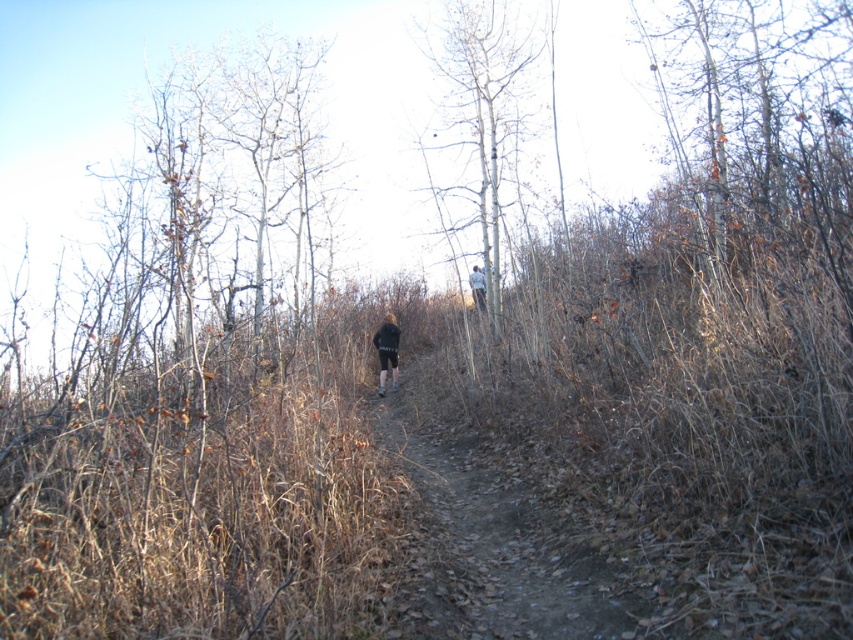
What do you see at coordinates (492, 544) in the screenshot?
I see `dirt path at center` at bounding box center [492, 544].

Which is in front, point (427, 460) or point (503, 99)?

Point (427, 460) is in front.

Does point (605, 586) come closer to viewer compared to point (467, 112)?

Yes, point (605, 586) is in front of point (467, 112).

At what (x,y) coordinates should I click in order to perform the action: click on dirt path at center. Please return your answer as a coordinate pair (x, y). Looking at the image, I should click on (492, 544).

Between point (410, 589) and point (473, 296), which one is positioned in front?

Point (410, 589) is in front.

Is dirt path at center above light blue denim jacket at upper center?

No.

What do you see at coordinates (492, 544) in the screenshot?
I see `dirt path at center` at bounding box center [492, 544].

The height and width of the screenshot is (640, 853). I want to click on dirt path at center, so [492, 544].

Looking at this image, can you confirm if smooth white tree at upper center is taller than dark gray fabric jacket at center?

Correct, smooth white tree at upper center is much taller as dark gray fabric jacket at center.

Can you confirm if smooth white tree at upper center is positioned to the right of dark gray fabric jacket at center?

Correct, you'll find smooth white tree at upper center to the right of dark gray fabric jacket at center.

Does point (436, 193) lie in front of point (386, 340)?

No, it is behind (386, 340).

Image resolution: width=853 pixels, height=640 pixels. Identify the location of smooth white tree at upper center. (482, 116).